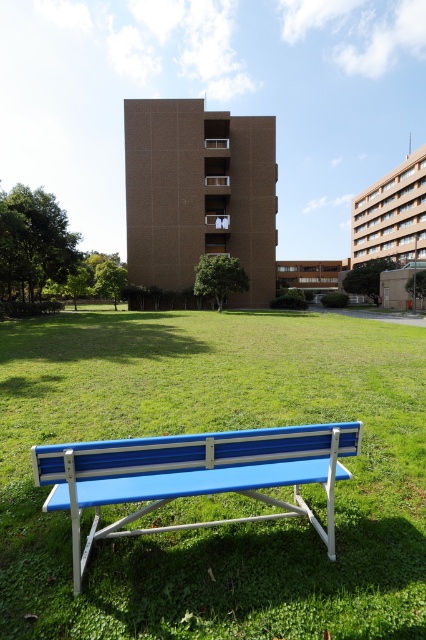
Question: Observing the image, what is the correct spatial positioning of blue plastic bench at center in reference to blue plastic bench at lower center?

Choices:
 (A) left
 (B) right

Answer: (B)

Question: Does blue plastic bench at center have a smaller size compared to blue plastic bench at lower center?

Choices:
 (A) no
 (B) yes

Answer: (A)

Question: Which object is closer to the camera taking this photo?

Choices:
 (A) blue plastic bench at lower center
 (B) blue plastic bench at center

Answer: (B)

Question: Which point appears closest to the camera in this image?

Choices:
 (A) (45, 474)
 (B) (212, 372)

Answer: (A)

Question: Can you confirm if blue plastic bench at center is positioned above blue plastic bench at lower center?

Choices:
 (A) no
 (B) yes

Answer: (B)